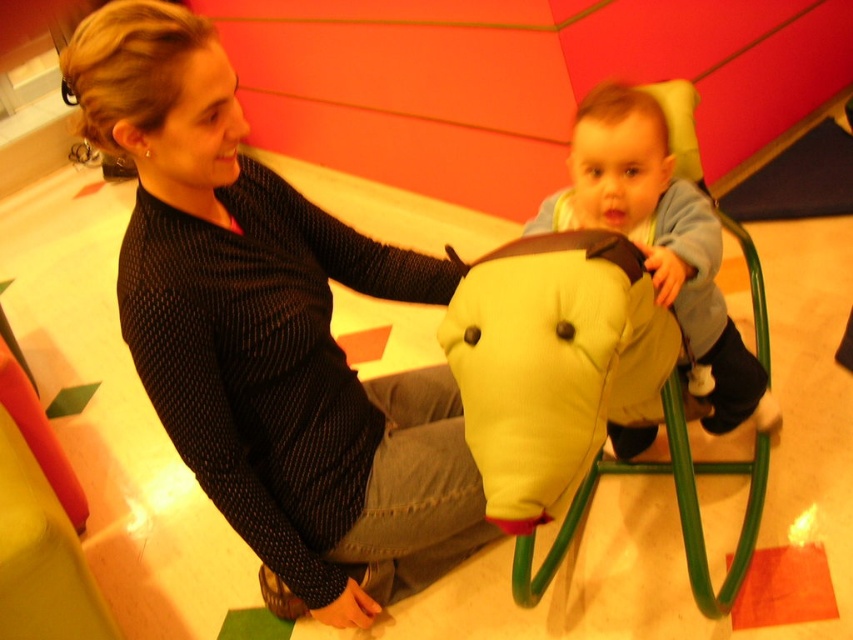
You are organizing a playroom and need to place the soft yellow fabric elephant at center and the soft yellow plush at center. According to the image, which object is located below the other?

The soft yellow fabric elephant at center is positioned under the soft yellow plush at center, so the fabric elephant is below the plush.

You are a parent trying to choose a toy for your child. You see the soft yellow fabric elephant at center and the soft yellow plush at center in the playroom. Which one is smaller?

The soft yellow fabric elephant at center is smaller than the soft yellow plush at center.